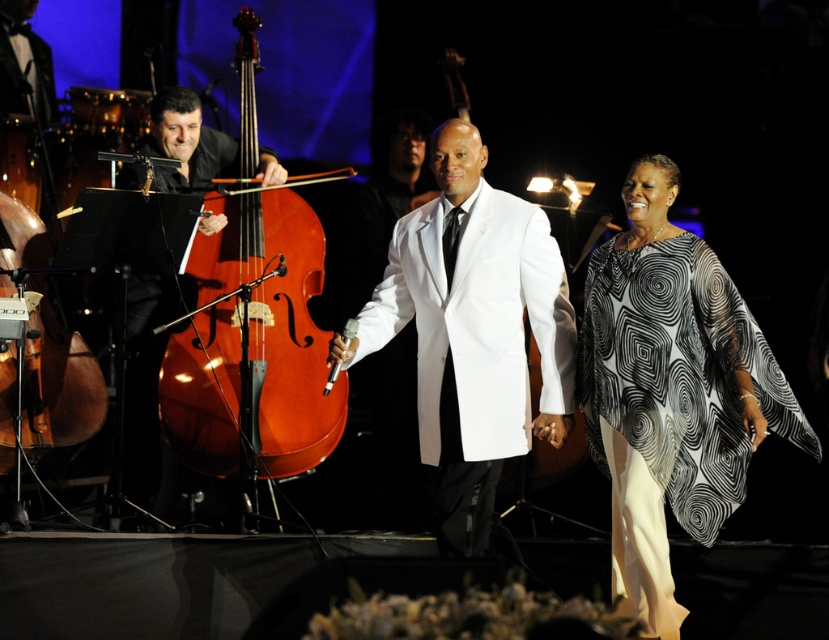
In the scene shown: You are a photographer at the event and want to capture a clear photo of the white satin suit at center without the black and white printed fabric at center blocking it. How should you adjust your camera position?

Move your camera position behind the white satin suit at center so that it is between the black and white printed fabric at center and the camera. This way, the white satin suit at center will be visible without obstruction from the fabric.

You are a stagehand who needs to move a 2.5 meter long ladder from the brown polished wood violin at left to the black and white printed fabric at center. Can you move the ladder without folding it?

The distance between the brown polished wood violin at left and the black and white printed fabric at center is 2.43 meters. Since the ladder is 2.5 meters long, it is slightly longer than the available space. Therefore, you would need to fold the ladder to move it between these two points.